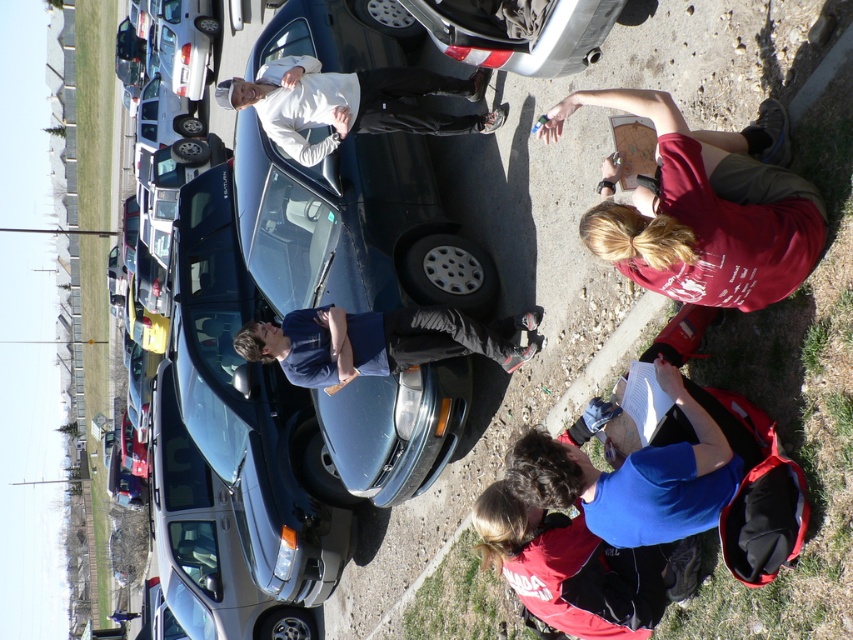
Which is in front, point (524, 608) or point (160, 586)?

Point (524, 608)

Who is taller, red fabric shirt at lower center or satin silver sedan at lower left?

satin silver sedan at lower left

Find the location of a particular element. The width and height of the screenshot is (853, 640). red fabric shirt at lower center is located at coordinates (579, 568).

You are a GUI agent. You are given a task and a screenshot of the screen. Output one action in this format:
    pyautogui.click(x=<x>, y=<y>)
    Task: Click on the red fabric shirt at lower center
    The height and width of the screenshot is (640, 853).
    Given the screenshot: What is the action you would take?
    pyautogui.click(x=579, y=568)

Between point (260, 115) and point (506, 371), which one is positioned in front?

Point (260, 115)

The width and height of the screenshot is (853, 640). I want to click on white matte shirt at center, so tap(351, 102).

Where is `red fabric shirt at lower center`? red fabric shirt at lower center is located at coordinates (579, 568).

Does red fabric shirt at lower center lie in front of white matte shirt at center?

That is True.

Which is behind, point (595, 573) or point (270, 116)?

The point (270, 116) is more distant.

Find the location of a particular element. The image size is (853, 640). red fabric shirt at lower center is located at coordinates (579, 568).